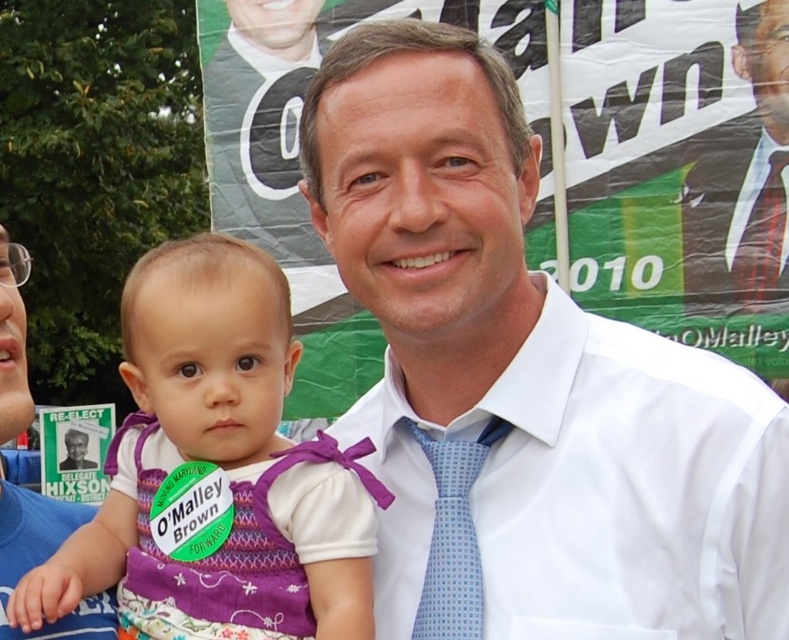
Question: Does white smooth dress shirt at center lie behind smooth black suit at center?

Choices:
 (A) yes
 (B) no

Answer: (B)

Question: Which of the following is the farthest from the observer?

Choices:
 (A) (148, 566)
 (B) (750, 257)
 (C) (55, 531)

Answer: (B)

Question: Among these points, which one is nearest to the camera?

Choices:
 (A) (746, 147)
 (B) (773, 252)
 (C) (436, 604)
 (D) (6, 296)

Answer: (C)

Question: In this image, where is purple fabric dress at center located relative to smooth black suit at center?

Choices:
 (A) below
 (B) above

Answer: (A)

Question: Based on their relative distances, which object is farther from the purple fabric dress at center?

Choices:
 (A) smooth black suit at center
 (B) blue dotted tie at upper right
 (C) light blue dotted tie at center

Answer: (B)

Question: Can you confirm if white smooth dress shirt at center is wider than light blue dotted tie at center?

Choices:
 (A) yes
 (B) no

Answer: (A)